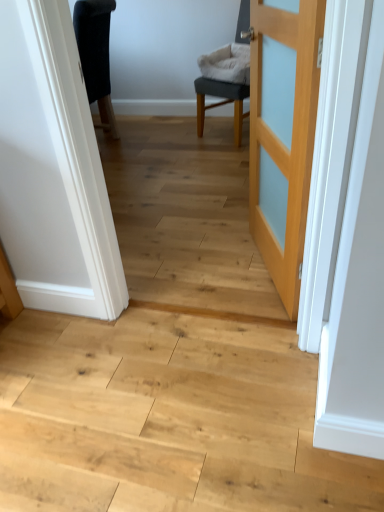
Find the location of a particular element. This screenshot has width=384, height=512. free space to the left of light wood door at center is located at coordinates (203, 269).